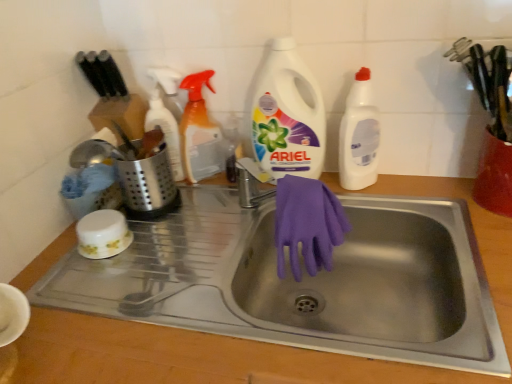
What are the coordinates of `spots to the right of white plastic detergent at center, marked as the 3th cleaning product in a left-to-right arrangement` in the screenshot? It's located at (383, 190).